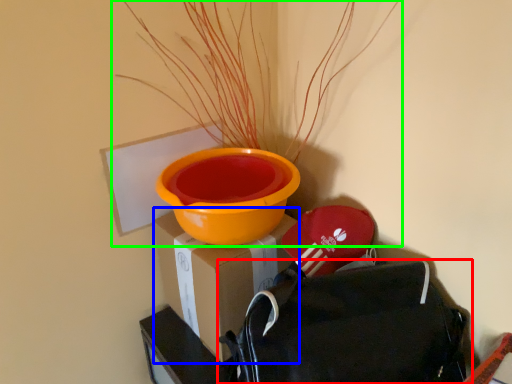
Question: Estimate the real-world distances between objects in this image. Which object is farther from backpack (highlighted by a red box), cardboard box (highlighted by a blue box) or houseplant (highlighted by a green box)?

Choices:
 (A) cardboard box
 (B) houseplant

Answer: (B)